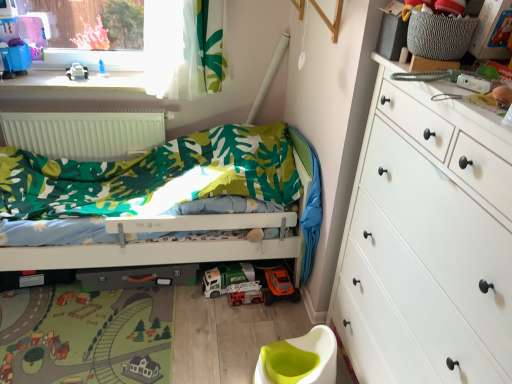
Question: Can you confirm if orange matte toy car at lower center is taller than metallic silver fire truck at center, which ranks as the 2th toy car in top-to-bottom order?

Choices:
 (A) no
 (B) yes

Answer: (B)

Question: Is orange matte toy car at lower center smaller than metallic silver fire truck at center, which is the 1th toy car in bottom-to-top order?

Choices:
 (A) no
 (B) yes

Answer: (A)

Question: Could you tell me if orange matte toy car at lower center is facing metallic silver fire truck at center, which ranks as the 2th toy car in top-to-bottom order?

Choices:
 (A) no
 (B) yes

Answer: (A)

Question: From the image's perspective, does orange matte toy car at lower center appear lower than metallic silver fire truck at center, which ranks as the 2th toy car in top-to-bottom order?

Choices:
 (A) no
 (B) yes

Answer: (A)

Question: Is orange matte toy car at lower center far away from metallic silver fire truck at center, which is the 1th toy car in bottom-to-top order?

Choices:
 (A) yes
 (B) no

Answer: (B)

Question: Is the position of orange matte toy car at lower center less distant than that of metallic silver fire truck at center, which ranks as the 2th toy car in top-to-bottom order?

Choices:
 (A) no
 (B) yes

Answer: (B)

Question: Could you tell me if metallic silver fire truck at center, which is the 1th toy car in bottom-to-top order, is turned towards white plastic toy car at upper left?

Choices:
 (A) yes
 (B) no

Answer: (B)

Question: Considering the relative sizes of metallic silver fire truck at center, which ranks as the 2th toy car in top-to-bottom order, and white plastic toy car at upper left in the image provided, is metallic silver fire truck at center, which ranks as the 2th toy car in top-to-bottom order, smaller than white plastic toy car at upper left?

Choices:
 (A) yes
 (B) no

Answer: (A)

Question: Is metallic silver fire truck at center, which ranks as the 2th toy car in top-to-bottom order, closer to camera compared to white plastic toy car at upper left?

Choices:
 (A) no
 (B) yes

Answer: (B)

Question: Is metallic silver fire truck at center, which ranks as the 2th toy car in top-to-bottom order, completely or partially outside of white plastic toy car at upper left?

Choices:
 (A) no
 (B) yes

Answer: (B)

Question: Does metallic silver fire truck at center, which is the 1th toy car in bottom-to-top order, appear on the right side of white plastic toy car at upper left?

Choices:
 (A) yes
 (B) no

Answer: (A)

Question: Would you consider metallic silver fire truck at center, which ranks as the 2th toy car in top-to-bottom order, to be distant from white plastic toy car at upper left?

Choices:
 (A) yes
 (B) no

Answer: (A)

Question: Is metallic silver fire truck at center, which is the 1th toy car in bottom-to-top order, located within white matte radiator at upper left?

Choices:
 (A) yes
 (B) no

Answer: (B)